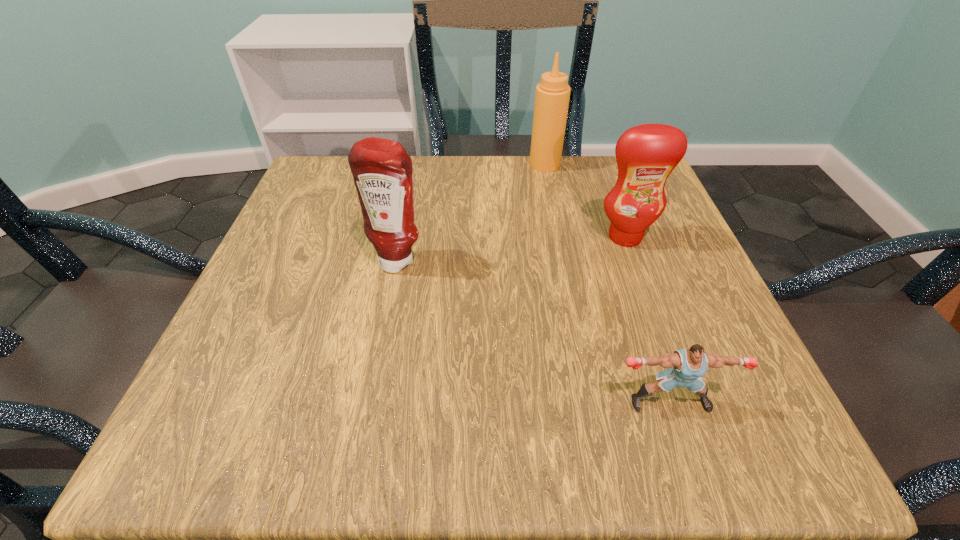
In the image, there is a desktop. Where is `free space at the near left corner`? This screenshot has height=540, width=960. free space at the near left corner is located at coordinates (206, 452).

At what (x,y) coordinates should I click in order to perform the action: click on free location at the far right corner. Please return your answer as a coordinate pair (x, y). The width and height of the screenshot is (960, 540). Looking at the image, I should click on (582, 159).

Find the location of a particular element. This screenshot has width=960, height=540. vacant space at the near right corner is located at coordinates 739,413.

Where is `vacant region between the leftmost condiment and the puncher`? The height and width of the screenshot is (540, 960). vacant region between the leftmost condiment and the puncher is located at coordinates (534, 331).

Where is `free space between the farthest object and the rightmost condiment`? The height and width of the screenshot is (540, 960). free space between the farthest object and the rightmost condiment is located at coordinates (585, 200).

This screenshot has height=540, width=960. I want to click on blank region between the farthest condiment and the nearest object, so click(607, 283).

Find the location of `vacant space in between the nearest object and the rightmost condiment`. vacant space in between the nearest object and the rightmost condiment is located at coordinates (647, 319).

The height and width of the screenshot is (540, 960). What are the coordinates of `vacant area that lies between the nearest object and the second condiment from left to right` in the screenshot? It's located at (607, 283).

The width and height of the screenshot is (960, 540). I want to click on empty space that is in between the leftmost condiment and the farthest condiment, so click(471, 212).

Find the location of a particular element. This screenshot has height=540, width=960. free space between the farthest condiment and the leftmost object is located at coordinates (471, 212).